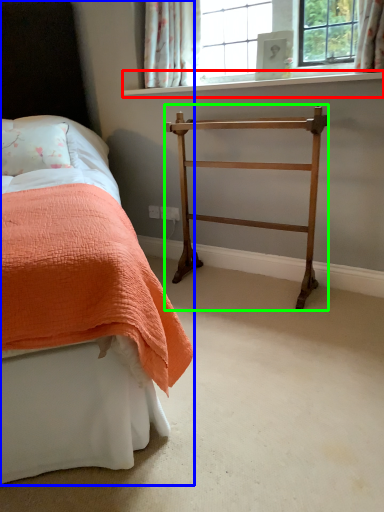
Question: Which is farther away from window sill (highlighted by a red box)? bed (highlighted by a blue box) or furniture (highlighted by a green box)?

Choices:
 (A) bed
 (B) furniture

Answer: (A)